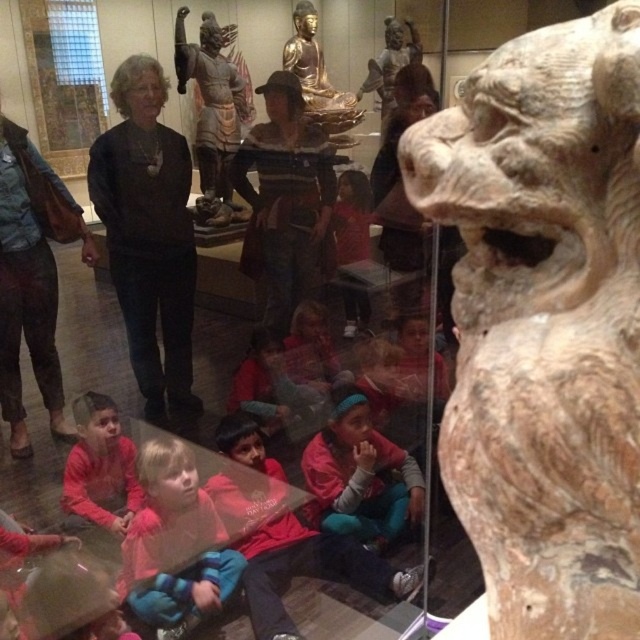
What are the coordinates of the gold polished statue at center?

The gold polished statue at center is located at coordinates point (x=317, y=81).

You are an art student standing in the museum. You see the beige stone lion at right and the gold metallic statue at upper center. Which object is positioned higher in the image?

The gold metallic statue at upper center is positioned higher in the image than the beige stone lion at right.